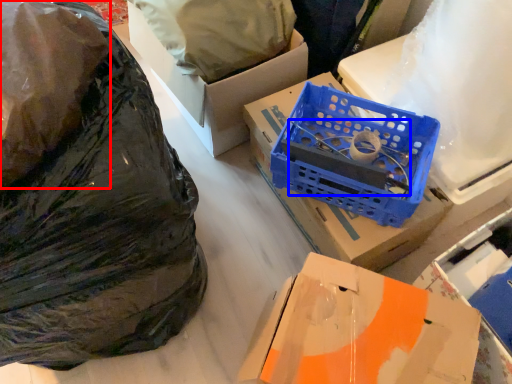
Question: Which object is further to the camera taking this photo, plastic bag (highlighted by a red box) or wire (highlighted by a blue box)?

Choices:
 (A) plastic bag
 (B) wire

Answer: (B)